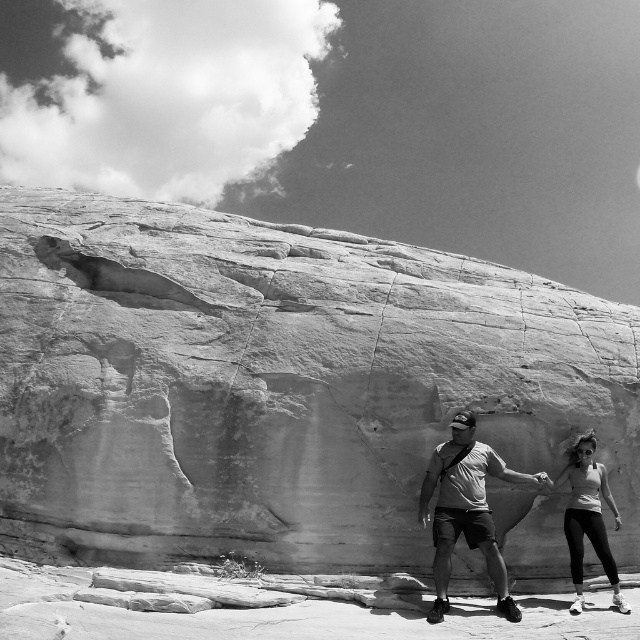
You are a photographer trying to capture a closeup of the rock formation. You notice the matte gray shorts at center and the smooth white tank top at lower right in your frame. Which object should you adjust your focus on if you want to ensure the rock formation remains the main subject?

The smooth white tank top at lower right is taller than the matte gray shorts at center. To keep the rock formation as the main subject, focus on the shorter object, which is the matte gray shorts at center, so it doesn

You are a photographer trying to capture the two people holding hands in front of the rock formation. To ensure both the rock and their clothing are clearly visible in your shot, you need to position yourself so that the smooth stone rock at center and the smooth white tank top at lower right are in the same focal plane. Based on their positions, is this possible?

The smooth stone rock at center is to the left of the smooth white tank top at lower right, so they are positioned horizontally adjacent. This means adjusting the camera to focus on a plane that includes both their horizontal positions should be feasible as they are aligned left to right without significant depth difference.

You are a photographer trying to capture a wide shot of the smooth stone rock at center and the matte gray shorts at center in the image. Given their sizes, which object should you focus on first to ensure both are in frame?

The smooth stone rock at center is larger than the matte gray shorts at center, so you should focus on the smooth stone rock at center first to ensure both are in frame.